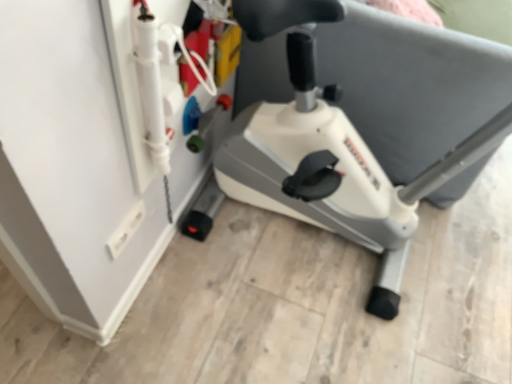
Question: From the image's perspective, is white plastic electric outlet at lower left positioned above or below white plastic stationary bicycle at center?

Choices:
 (A) below
 (B) above

Answer: (A)

Question: Based on their positions, is white plastic electric outlet at lower left located to the left or right of white plastic stationary bicycle at center?

Choices:
 (A) left
 (B) right

Answer: (A)

Question: Looking at their shapes, would you say white plastic electric outlet at lower left is wider or thinner than white plastic stationary bicycle at center?

Choices:
 (A) wide
 (B) thin

Answer: (B)

Question: Do you think white plastic stationary bicycle at center is within white plastic electric outlet at lower left, or outside of it?

Choices:
 (A) outside
 (B) inside

Answer: (A)

Question: From a real-world perspective, is white plastic stationary bicycle at center above or below white plastic electric outlet at lower left?

Choices:
 (A) above
 (B) below

Answer: (A)

Question: Relative to white plastic electric outlet at lower left, is white plastic stationary bicycle at center in front or behind?

Choices:
 (A) front
 (B) behind

Answer: (A)

Question: Based on their positions, is white plastic stationary bicycle at center located to the left or right of white plastic electric outlet at lower left?

Choices:
 (A) left
 (B) right

Answer: (B)